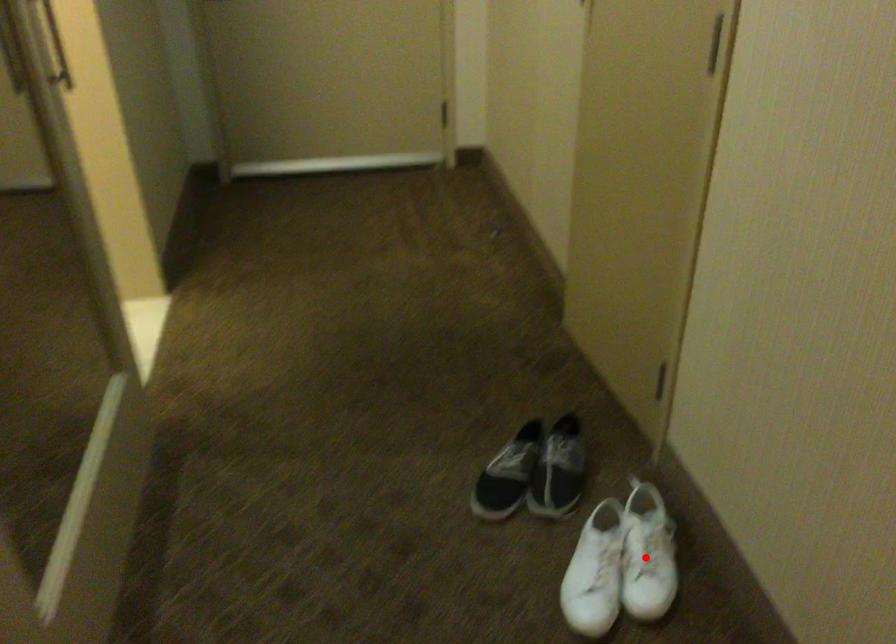
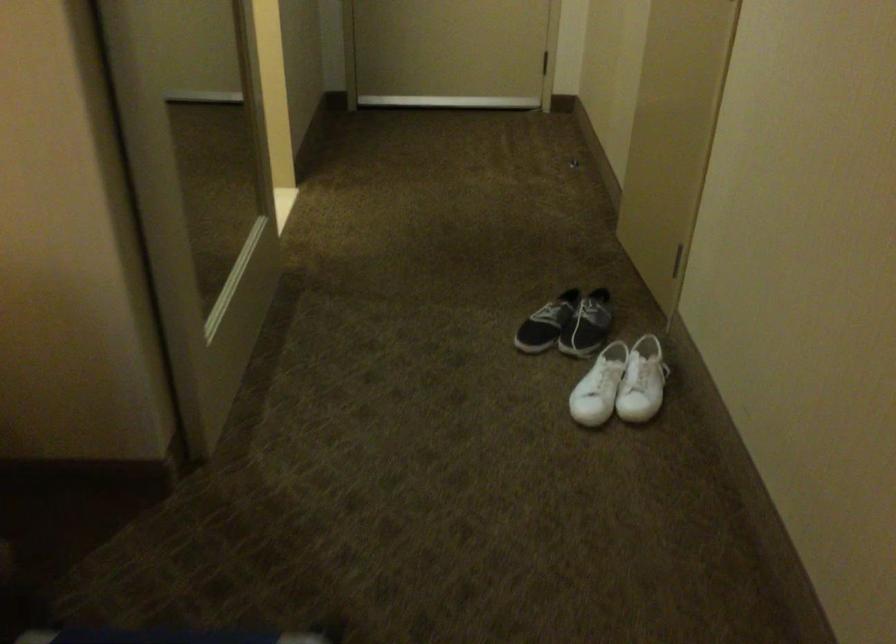
The point at the highlighted location is marked in the first image. Where is the corresponding point in the second image?

(642, 382)